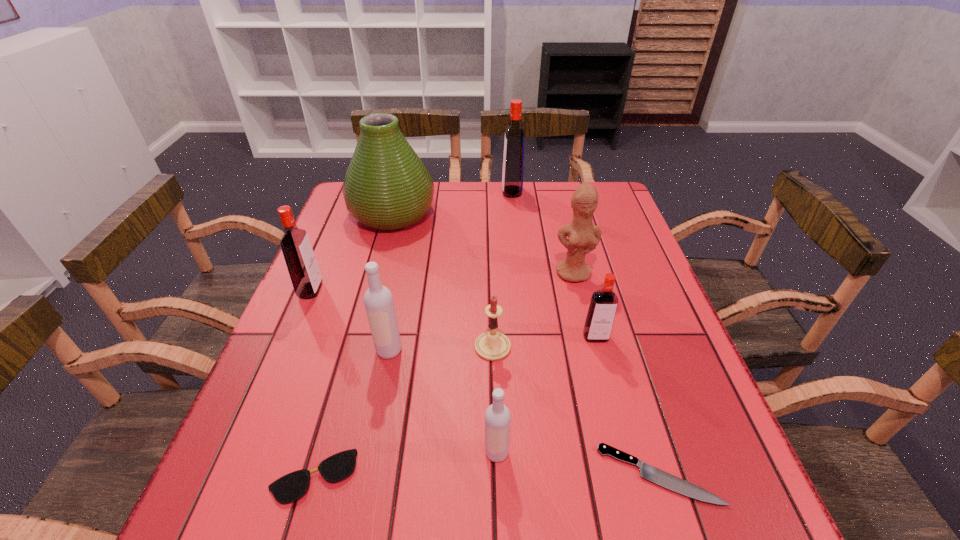
Locate which vodka is the second closest to the steak knife. Please provide its 2D coordinates. Your answer should be formatted as a tuple, i.e. [(x, y)], where the tuple contains the x and y coordinates of a point satisfying the conditions above.

[(601, 313)]

The image size is (960, 540). Identify the location of red vodka object that ranks as the second closest to the biggest red vodka. (302, 265).

Locate an element on the screen. This screenshot has width=960, height=540. red vodka that is the second closest to the tallest vodka is located at coordinates pos(302,265).

Locate an element on the screen. vacant space that satisfies the following two spatial constraints: 1. on the front and back of the steak knife; 2. on the right side of the fourth nearest vodka is located at coordinates (232, 475).